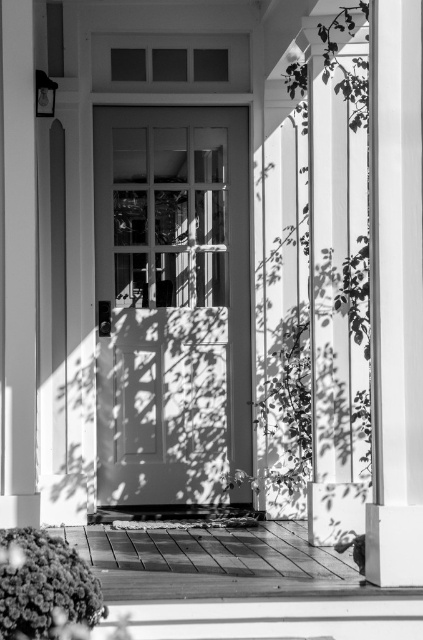
You are standing in front of the house and want to enter through the matte gray door at center. To your right, there is a smooth white column at right. Which direction should you walk to reach the door without hitting the column?

Since the matte gray door at center is positioned on the left side of the smooth white column at right, you should walk to the left of the smooth white column at right to reach the matte gray door at center safely.

You need to hang a large rectangular painting that is 1.5 meters wide. You have two options on the wall in front of you, either on the matte gray door at center or the smooth white pillar at right. Based on their sizes, which surface can accommodate the painting without overlapping its edges?

The matte gray door at center has a larger size compared to the smooth white pillar at right, so the painting can be placed on the matte gray door at center without overlapping its edges.